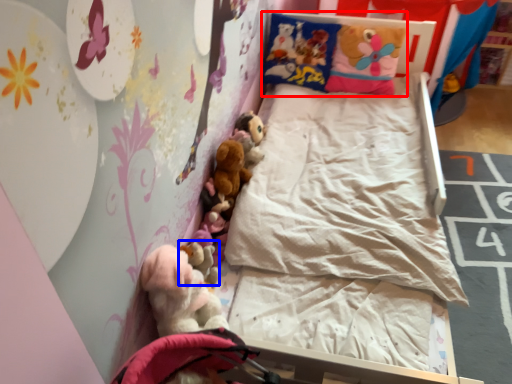
Question: Which object appears closest to the camera in this image, pillow (highlighted by a red box) or toy (highlighted by a blue box)?

Choices:
 (A) pillow
 (B) toy

Answer: (B)